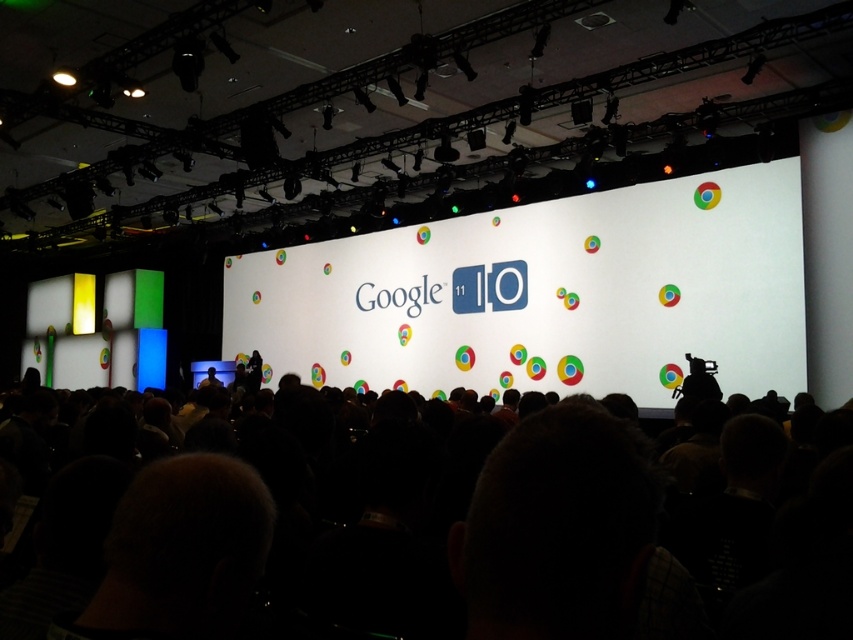
Does white paper at center have a greater height compared to dark blue fabric at center?

Correct, white paper at center is much taller as dark blue fabric at center.

Who is shorter, white paper at center or dark blue fabric at center?

Standing shorter between the two is dark blue fabric at center.

Is point (309, 282) behind point (207, 380)?

That is True.

Locate an element on the screen. This screenshot has height=640, width=853. white paper at center is located at coordinates (544, 294).

Does white paper at center appear on the left side of black matte crowd at center?

Indeed, white paper at center is positioned on the left side of black matte crowd at center.

Locate an element on the screen. This screenshot has width=853, height=640. white paper at center is located at coordinates (544, 294).

You are a GUI agent. You are given a task and a screenshot of the screen. Output one action in this format:
    pyautogui.click(x=<x>, y=<y>)
    Task: Click on the white paper at center
    
    Given the screenshot: What is the action you would take?
    pyautogui.click(x=544, y=294)

Who is positioned more to the right, black matte crowd at center or dark blue fabric at center?

From the viewer's perspective, black matte crowd at center appears more on the right side.

Does black matte crowd at center lie in front of dark blue fabric at center?

Yes, black matte crowd at center is closer to the viewer.

This screenshot has width=853, height=640. What do you see at coordinates (721, 544) in the screenshot?
I see `black matte crowd at center` at bounding box center [721, 544].

This screenshot has height=640, width=853. What are the coordinates of `black matte crowd at center` in the screenshot? It's located at (721, 544).